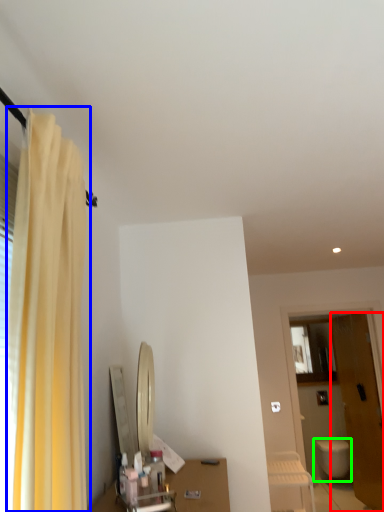
Question: Based on their relative distances, which object is farther from door (highlighted by a red box)? Choose from curtain (highlighted by a blue box) and toilet (highlighted by a green box).

Choices:
 (A) curtain
 (B) toilet

Answer: (A)